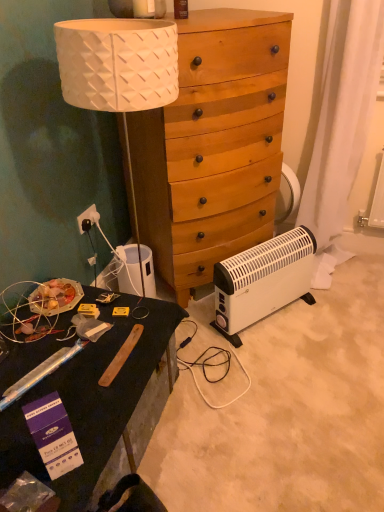
Question: Considering the relative sizes of black matte desk at lower left and wooden dresser at center in the image provided, is black matte desk at lower left taller than wooden dresser at center?

Choices:
 (A) no
 (B) yes

Answer: (A)

Question: Considering the relative positions of black matte desk at lower left and wooden dresser at center in the image provided, is black matte desk at lower left to the right of wooden dresser at center from the viewer's perspective?

Choices:
 (A) no
 (B) yes

Answer: (A)

Question: Is the position of black matte desk at lower left more distant than that of wooden dresser at center?

Choices:
 (A) no
 (B) yes

Answer: (A)

Question: From the image's perspective, does black matte desk at lower left appear higher than wooden dresser at center?

Choices:
 (A) no
 (B) yes

Answer: (A)

Question: Considering the relative sizes of black matte desk at lower left and wooden dresser at center in the image provided, is black matte desk at lower left shorter than wooden dresser at center?

Choices:
 (A) yes
 (B) no

Answer: (A)

Question: Is black matte desk at lower left bigger than wooden dresser at center?

Choices:
 (A) yes
 (B) no

Answer: (B)

Question: Does black matte desk at lower left have a lesser height compared to white plastic power outlet at lower left?

Choices:
 (A) no
 (B) yes

Answer: (A)

Question: Is black matte desk at lower left at the right side of white plastic power outlet at lower left?

Choices:
 (A) no
 (B) yes

Answer: (B)

Question: Does black matte desk at lower left lie behind white plastic power outlet at lower left?

Choices:
 (A) no
 (B) yes

Answer: (A)

Question: Is black matte desk at lower left bigger than white plastic power outlet at lower left?

Choices:
 (A) no
 (B) yes

Answer: (B)

Question: Is black matte desk at lower left positioned before white plastic power outlet at lower left?

Choices:
 (A) no
 (B) yes

Answer: (B)

Question: Considering the relative sizes of black matte desk at lower left and white plastic power outlet at lower left in the image provided, is black matte desk at lower left taller than white plastic power outlet at lower left?

Choices:
 (A) no
 (B) yes

Answer: (B)

Question: Does white plastic power outlet at lower left have a greater width compared to wooden dresser at center?

Choices:
 (A) no
 (B) yes

Answer: (A)